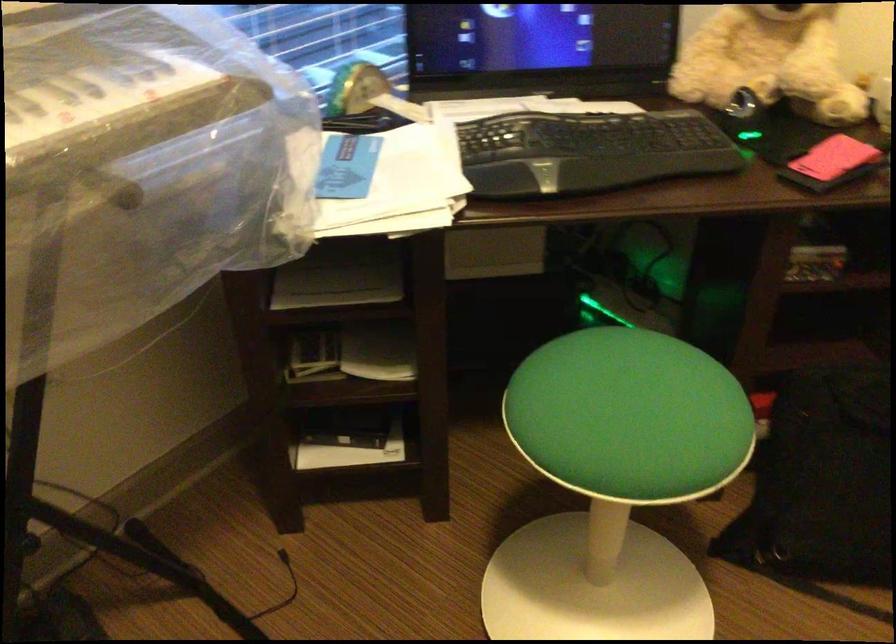
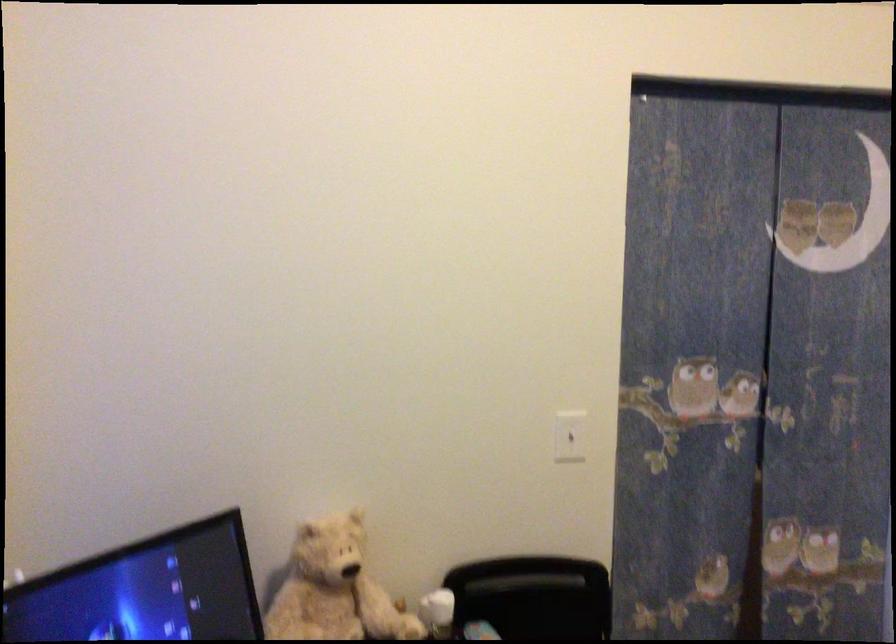
Based on the continuous images, in which direction is the camera rotating?

The camera's rotation is toward right-up.